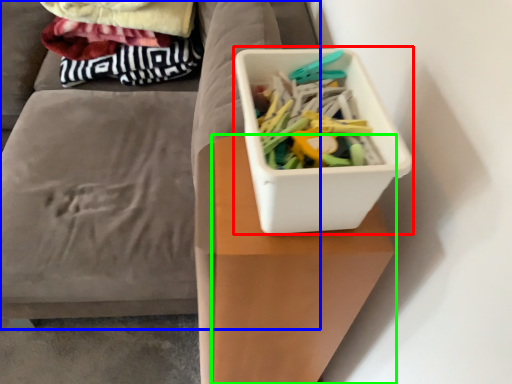
Question: Which object is the farthest from storage box (highlighted by a red box)? Choose among these: furniture (highlighted by a blue box) or table (highlighted by a green box).

Choices:
 (A) furniture
 (B) table

Answer: (A)